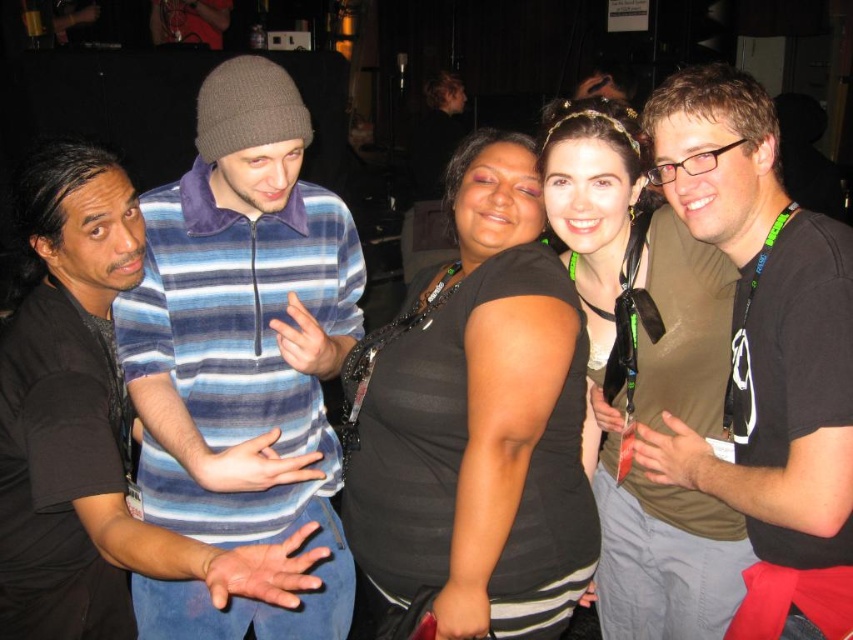
Is point (683, 150) farther from camera compared to point (728, 362)?

No, it is in front of (728, 362).

Can you confirm if matte black shirt at right is positioned to the left of matte black shirt at center?

No, matte black shirt at right is not to the left of matte black shirt at center.

Locate an element on the screen. Image resolution: width=853 pixels, height=640 pixels. matte black shirt at right is located at coordinates (761, 324).

The image size is (853, 640). What are the coordinates of `matte black shirt at right` in the screenshot? It's located at pos(761,324).

Where is `striped cotton shirt at left`? The width and height of the screenshot is (853, 640). striped cotton shirt at left is located at coordinates (242, 355).

Can you confirm if striped cotton shirt at left is positioned below black matte shirt at center?

Correct, striped cotton shirt at left is located below black matte shirt at center.

Image resolution: width=853 pixels, height=640 pixels. Describe the element at coordinates (242, 355) in the screenshot. I see `striped cotton shirt at left` at that location.

You are a GUI agent. You are given a task and a screenshot of the screen. Output one action in this format:
    pyautogui.click(x=<x>, y=<y>)
    Task: Click on the striped cotton shirt at left
    
    Given the screenshot: What is the action you would take?
    pyautogui.click(x=242, y=355)

Who is shorter, striped cotton shirt at left or matte black shirt at right?

Standing shorter between the two is matte black shirt at right.

Does striped cotton shirt at left have a lesser height compared to matte black shirt at right?

No, striped cotton shirt at left is not shorter than matte black shirt at right.

Is point (201, 483) farther from camera compared to point (851, 492)?

Yes.

The height and width of the screenshot is (640, 853). I want to click on striped cotton shirt at left, so click(x=242, y=355).